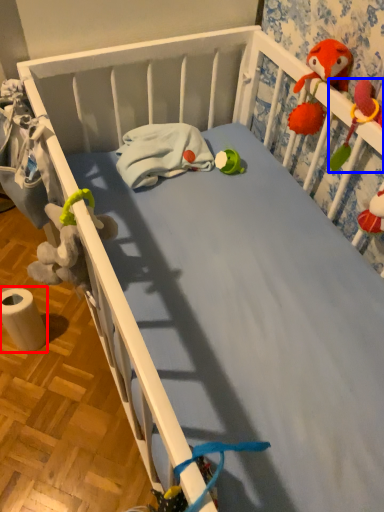
Question: Which of the following is the farthest to the observer, toilet paper (highlighted by a red box) or toy (highlighted by a blue box)?

Choices:
 (A) toilet paper
 (B) toy

Answer: (A)